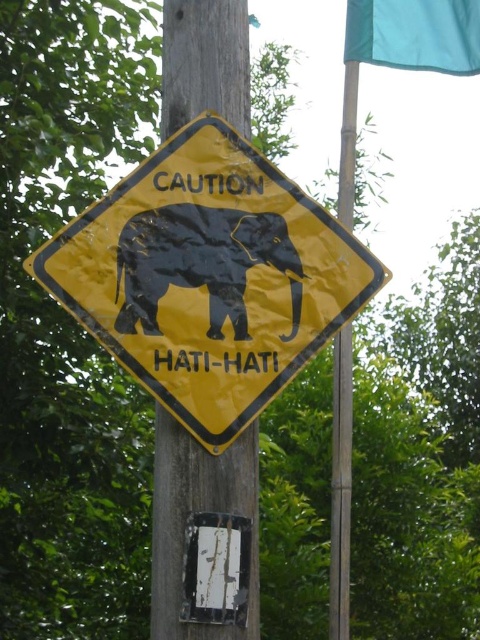
Who is taller, wooden telegraph pole at center or black rubber elephant at center?

Standing taller between the two is wooden telegraph pole at center.

Measure the distance between point (224, 454) and camera.

Point (224, 454) is 6.79 feet away from camera.

Image resolution: width=480 pixels, height=640 pixels. What do you see at coordinates (203, 513) in the screenshot?
I see `wooden telegraph pole at center` at bounding box center [203, 513].

Find the location of a particular element. wooden telegraph pole at center is located at coordinates (203, 513).

Image resolution: width=480 pixels, height=640 pixels. What do you see at coordinates (208, 276) in the screenshot?
I see `yellow matte sign at center` at bounding box center [208, 276].

Is yellow matte sign at center wider than black rubber elephant at center?

Yes.

At what (x,y) coordinates should I click in order to perform the action: click on yellow matte sign at center. Please return your answer as a coordinate pair (x, y). Image resolution: width=480 pixels, height=640 pixels. Looking at the image, I should click on (208, 276).

Is yellow matte sign at center closer to the viewer compared to teal fabric flag at upper right?

Yes, yellow matte sign at center is in front of teal fabric flag at upper right.

Can you confirm if yellow matte sign at center is positioned to the right of teal fabric flag at upper right?

Incorrect, yellow matte sign at center is not on the right side of teal fabric flag at upper right.

This screenshot has height=640, width=480. In order to click on yellow matte sign at center in this screenshot , I will do pyautogui.click(x=208, y=276).

Find the location of a particular element. The width and height of the screenshot is (480, 640). yellow matte sign at center is located at coordinates (208, 276).